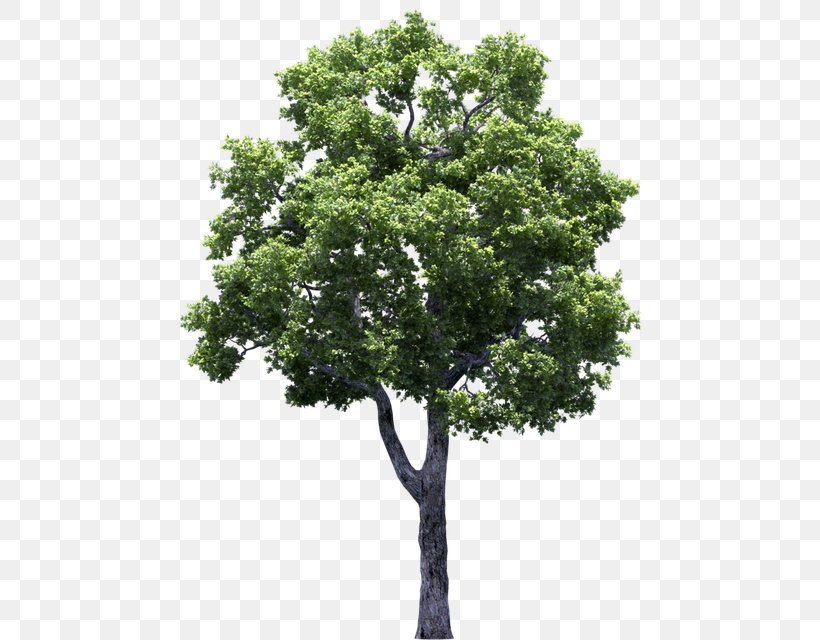
Identify the location of backdrop. This screenshot has height=640, width=820. (658, 441).